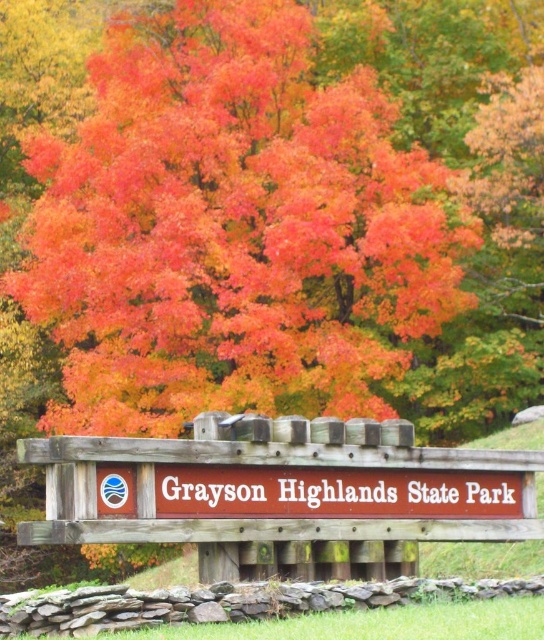
Question: Can you confirm if vivid orange leaves at center is positioned below brown wooden sign at center?

Choices:
 (A) yes
 (B) no

Answer: (B)

Question: Which point is farther from the camera taking this photo?

Choices:
 (A) (245, 451)
 (B) (151, 317)

Answer: (B)

Question: Is vivid orange leaves at center to the left of brown wooden sign at center from the viewer's perspective?

Choices:
 (A) yes
 (B) no

Answer: (A)

Question: Which point is closer to the camera?

Choices:
 (A) (460, 531)
 (B) (257, 358)

Answer: (A)

Question: Which object appears farthest from the camera in this image?

Choices:
 (A) vivid orange leaves at center
 (B) brown wooden sign at center

Answer: (A)

Question: Is vivid orange leaves at center behind brown wooden sign at center?

Choices:
 (A) no
 (B) yes

Answer: (B)